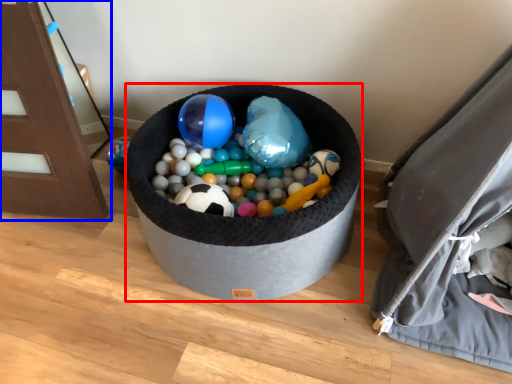
Question: Which object appears farthest to the camera in this image, toy (highlighted by a red box) or furniture (highlighted by a blue box)?

Choices:
 (A) toy
 (B) furniture

Answer: (A)